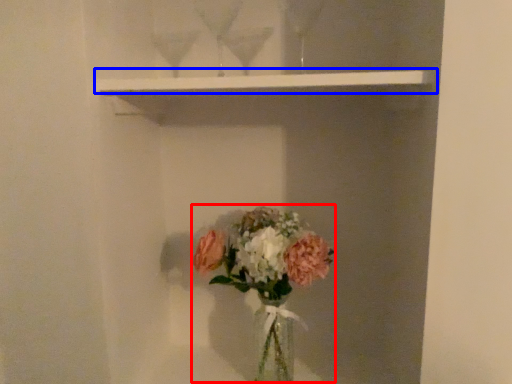
Question: Which object is further to the camera taking this photo, floral arrangement (highlighted by a red box) or window sill (highlighted by a blue box)?

Choices:
 (A) floral arrangement
 (B) window sill

Answer: (A)